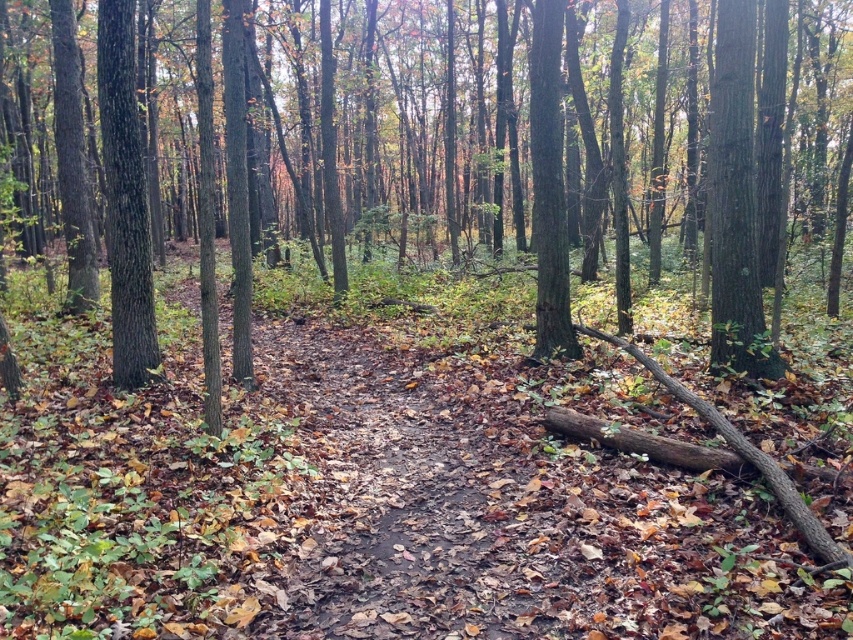
You are a hiker who wants to take a photo of both the brown rough tree at center and the smooth brown tree trunk at left. Which tree should you stand closer to in order to capture both in the same frame?

You should stand closer to the smooth brown tree trunk at left because the brown rough tree at center is positioned on the right side of it, so moving closer to the left tree will help include both in the frame.